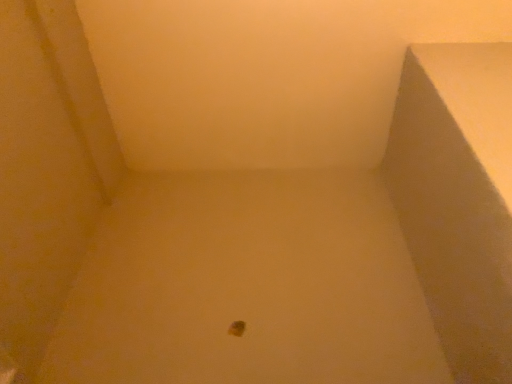
This screenshot has width=512, height=384. Describe the element at coordinates (237, 328) in the screenshot. I see `brown matte hole at center` at that location.

Identify the location of brown matte hole at center. (237, 328).

Image resolution: width=512 pixels, height=384 pixels. I want to click on brown matte hole at center, so click(x=237, y=328).